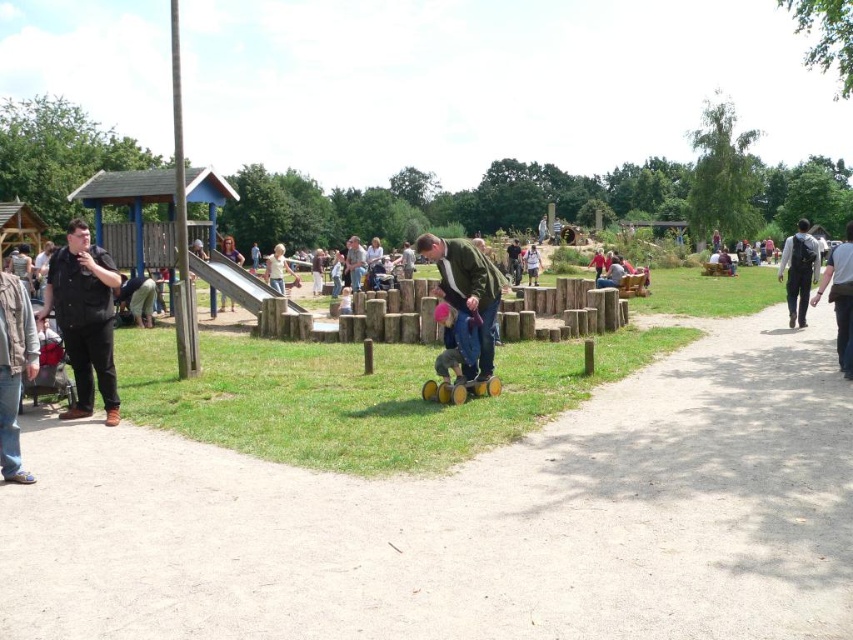
Who is more forward, (154, 285) or (277, 268)?

Point (154, 285)

Can you confirm if dark brown leather jacket at left is taller than light yellow shirt at center?

In fact, dark brown leather jacket at left may be shorter than light yellow shirt at center.

You are a GUI agent. You are given a task and a screenshot of the screen. Output one action in this format:
    pyautogui.click(x=<x>, y=<y>)
    Task: Click on the dark brown leather jacket at left
    
    Given the screenshot: What is the action you would take?
    pyautogui.click(x=137, y=298)

Locate an element on the screen. This screenshot has width=853, height=640. dark brown leather jacket at left is located at coordinates (137, 298).

Describe the element at coordinates (469, 520) in the screenshot. I see `smooth concrete path at center` at that location.

Is smooth concrete path at center further to camera compared to light yellow shirt at center?

No, it is not.

What do you see at coordinates (469, 520) in the screenshot? The height and width of the screenshot is (640, 853). I see `smooth concrete path at center` at bounding box center [469, 520].

I want to click on smooth concrete path at center, so click(469, 520).

Who is positioned more to the right, black backpack at right or light blue fabric at center?

From the viewer's perspective, black backpack at right appears more on the right side.

Is black backpack at right to the right of light blue fabric at center from the viewer's perspective?

Yes, black backpack at right is to the right of light blue fabric at center.

Who is more distant from viewer, [825,276] or [344,308]?

Point [344,308]

In order to click on black backpack at right in this screenshot , I will do 840,298.